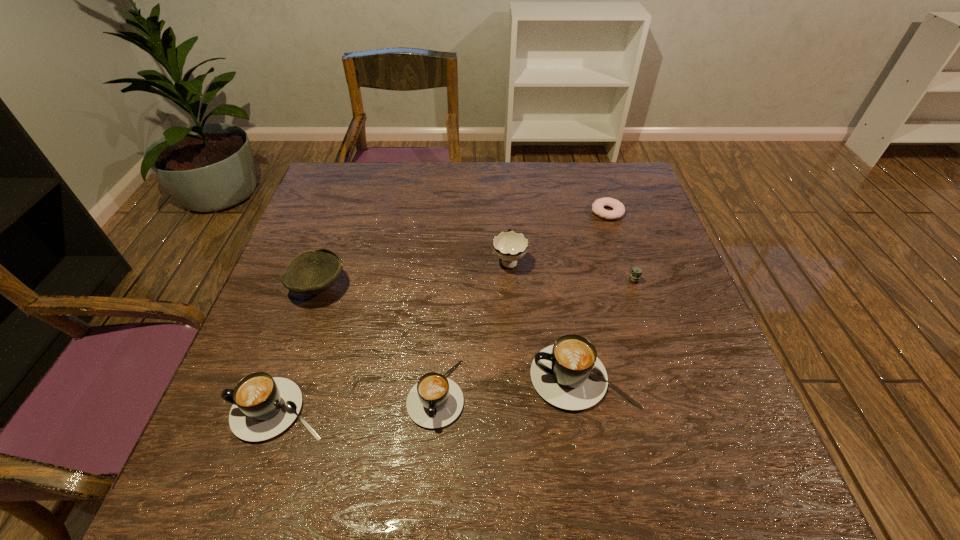
What are the coordinates of `object that is the sixth closest one to the rightmost cappuccino` in the screenshot? It's located at (312, 272).

Identify the location of cappuccino that is the nearest to the shortest cappuccino. (568, 374).

I want to click on cappuccino that is the closest to the farthest object, so click(x=568, y=374).

Where is `vacant space that satisfies the following two spatial constraints: 1. on the side of the cup with the handle; 2. on the right side of the farthest object`? This screenshot has height=540, width=960. vacant space that satisfies the following two spatial constraints: 1. on the side of the cup with the handle; 2. on the right side of the farthest object is located at coordinates (506, 212).

This screenshot has height=540, width=960. In order to click on free location that satisfies the following two spatial constraints: 1. with the handle on the side of the shortest cappuccino; 2. with the handle on the side of the second shortest cappuccino in this screenshot , I will do `click(435, 410)`.

In order to click on blank area in the image that satisfies the following two spatial constraints: 1. with the handle on the side of the rightmost cappuccino; 2. with the handle on the side of the shortest cappuccino in this screenshot , I will do `click(586, 393)`.

Where is `vacant region that satisfies the following two spatial constraints: 1. with the handle on the side of the rightmost cappuccino; 2. with the handle on the side of the second cappuccino from right to left`? vacant region that satisfies the following two spatial constraints: 1. with the handle on the side of the rightmost cappuccino; 2. with the handle on the side of the second cappuccino from right to left is located at coordinates (586, 393).